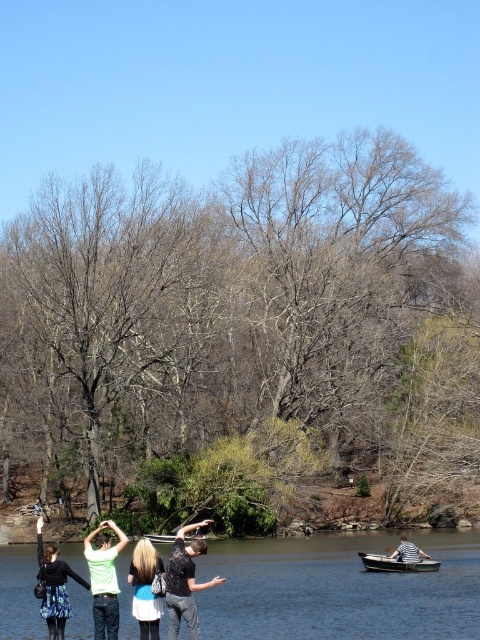
Question: Estimate the real-world distances between objects in this image. Which object is farther from the wooden canoe at lower center?

Choices:
 (A) striped fabric boat at lower right
 (B) blue denim jacket at center
 (C) matte black dress at lower left

Answer: (B)

Question: Which object is positioned closest to the green matte shirt at center?

Choices:
 (A) black matte shirt at center
 (B) wooden canoe at lower center
 (C) matte black dress at lower left

Answer: (C)

Question: Considering the relative positions of matte black dress at lower left and striped fabric boat at lower right in the image provided, where is matte black dress at lower left located with respect to striped fabric boat at lower right?

Choices:
 (A) right
 (B) left

Answer: (B)

Question: Among these points, which one is nearest to the camera?

Choices:
 (A) (96, 593)
 (B) (149, 604)
 (C) (387, 541)
 (D) (55, 564)

Answer: (B)

Question: Is green matte shirt at center smaller than matte black dress at lower left?

Choices:
 (A) no
 (B) yes

Answer: (B)

Question: Does matte black dress at lower left come behind blue denim jacket at center?

Choices:
 (A) yes
 (B) no

Answer: (A)